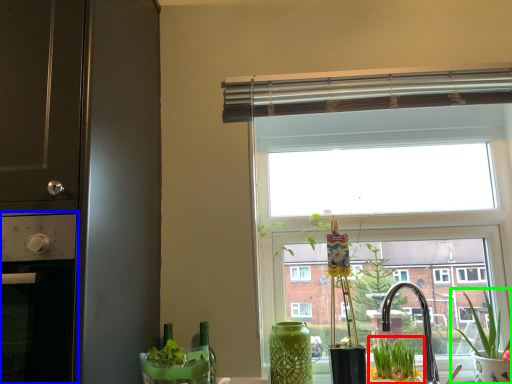
Question: Which is farther away from houseplant (highlighted by a red box)? appliance (highlighted by a blue box) or houseplant (highlighted by a green box)?

Choices:
 (A) appliance
 (B) houseplant

Answer: (A)